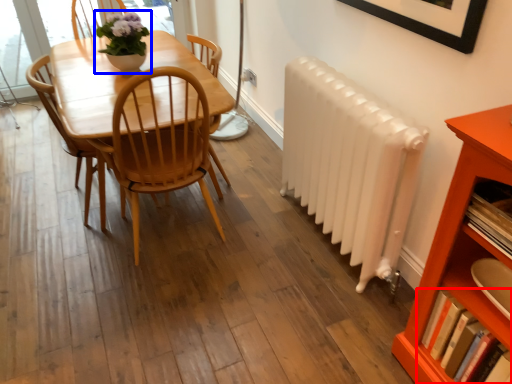
Question: Which of the following is the closest to the observer, book (highlighted by a red box) or houseplant (highlighted by a blue box)?

Choices:
 (A) book
 (B) houseplant

Answer: (A)